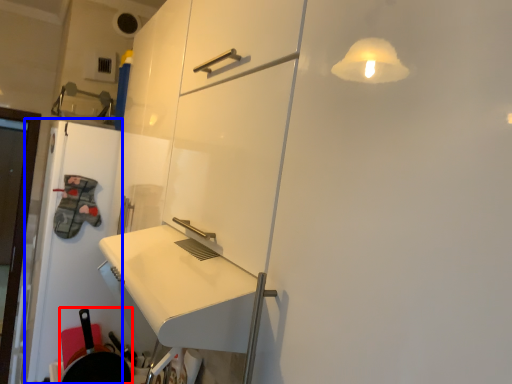
Question: Among these objects, which one is farthest to the camera, frying pan (highlighted by a red box) or door (highlighted by a blue box)?

Choices:
 (A) frying pan
 (B) door

Answer: (B)